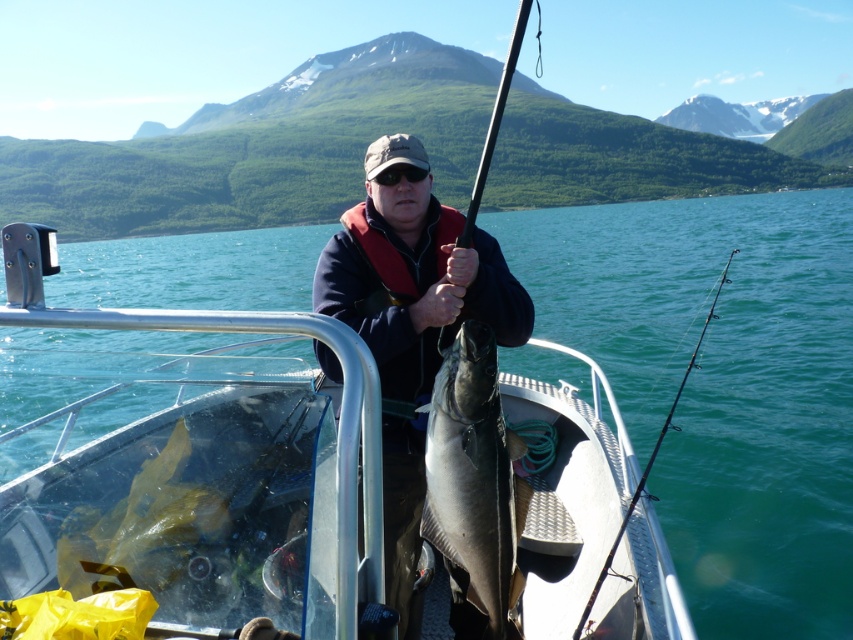
You are a photographer capturing the fishing scene. You want to ensure the shiny silver fish at center and the smooth black rod at center are both visible in your shot. Based on their positions, which object should you focus on first to capture both in the frame?

The shiny silver fish at center is located below the smooth black rod at center. To capture both in the frame, focus on the smooth black rod at center first, as it is above the fish, ensuring the fish remains within the lower part of the frame.

You are an observer on the boat and want to know if the shiny silver fish at center can fit into a container that is the same size as the smooth black rod at center. Can it fit?

The shiny silver fish at center occupies less space than the smooth black rod at center, so yes, it can fit into a container the same size as the smooth black rod at center.